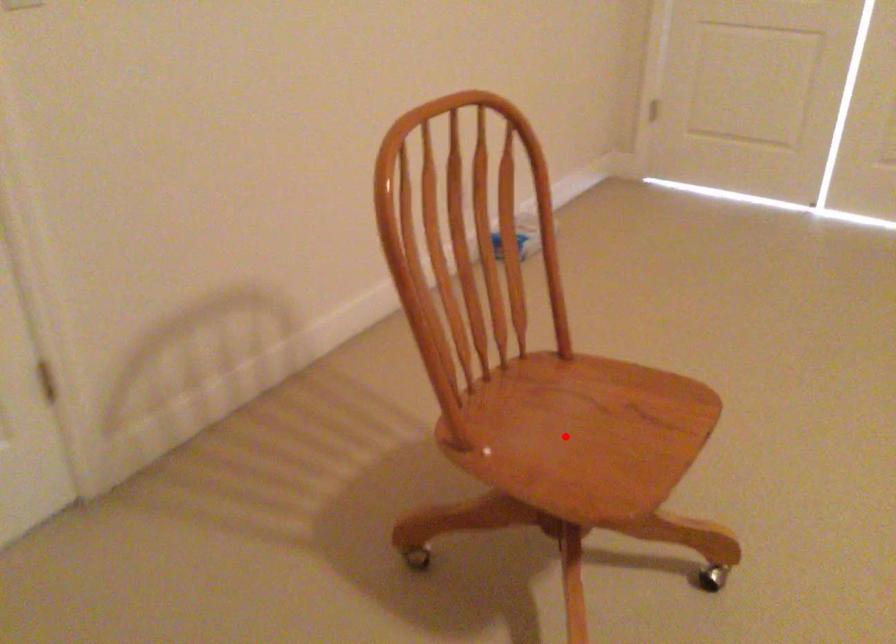
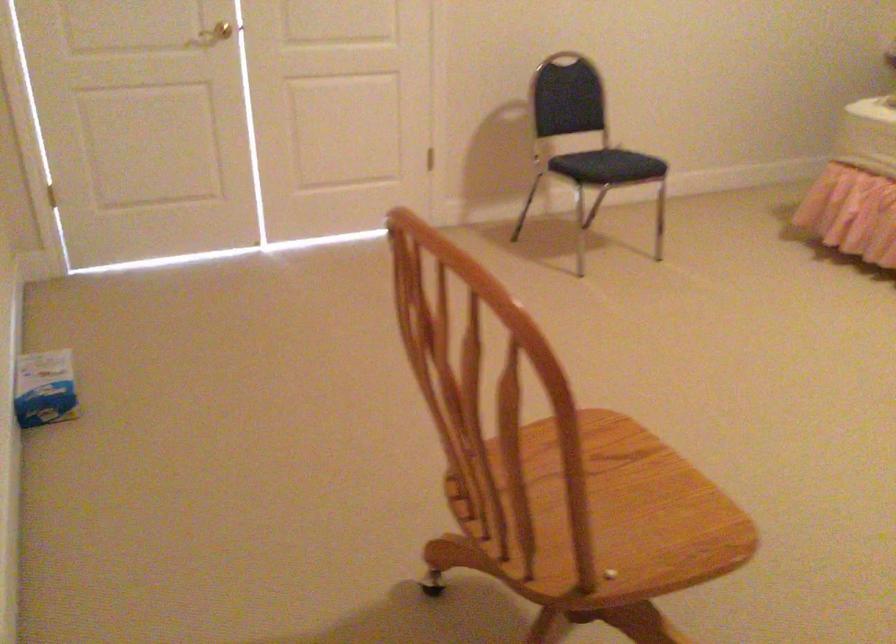
Question: I am providing you with two images of the same scene from different viewpoints. A red point is marked on the first image. Can you still see the location of the red point in image 2?

Choices:
 (A) Yes
 (B) No

Answer: (B)